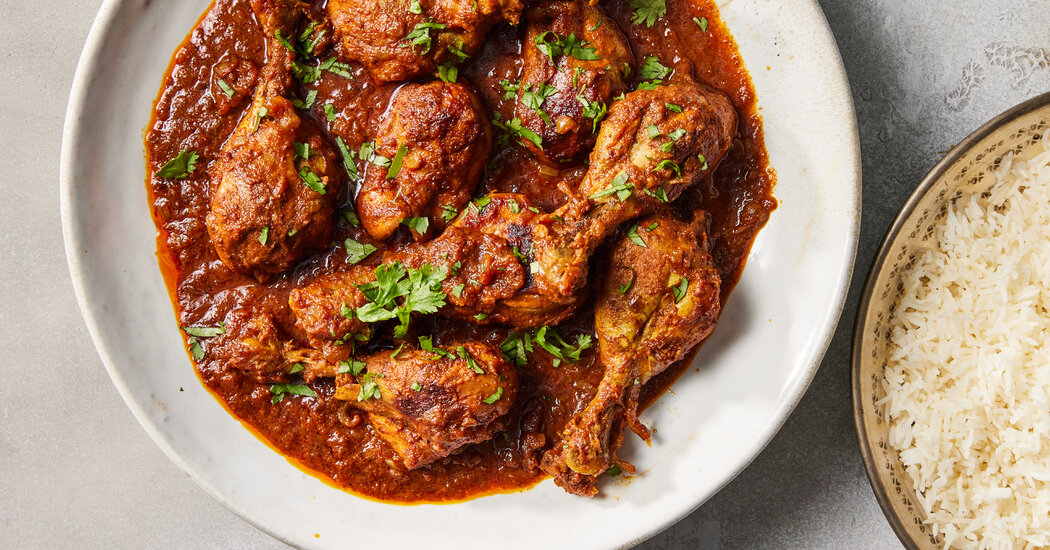
Locate an element on the screen. left side of white plate is located at coordinates (92, 221).